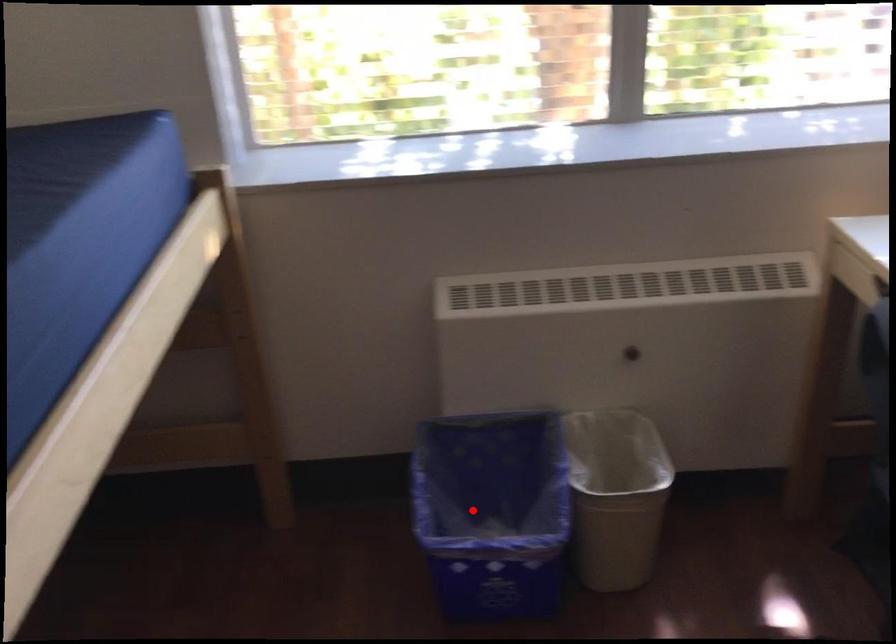
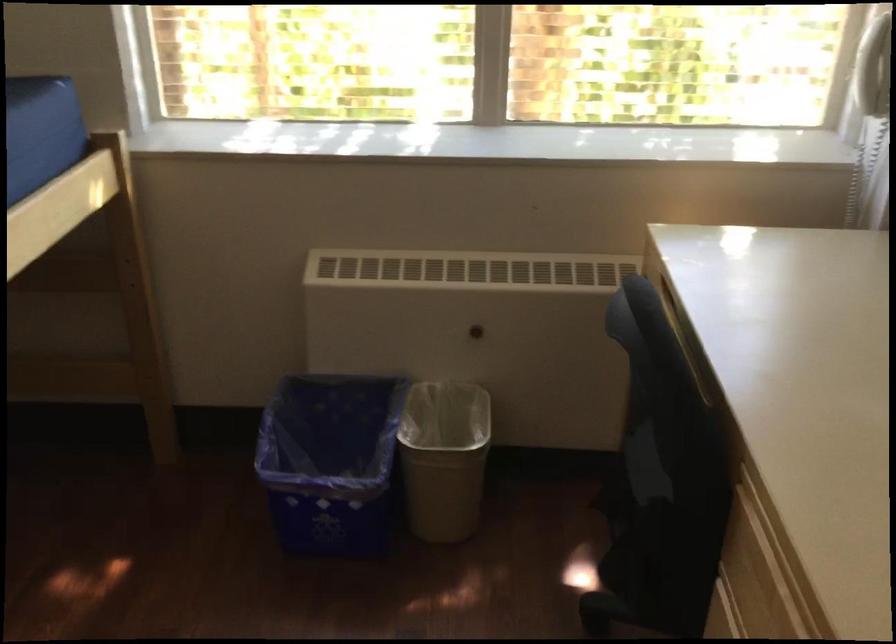
Find the pixel in the second image that matches the highlighted location in the first image.

(330, 462)